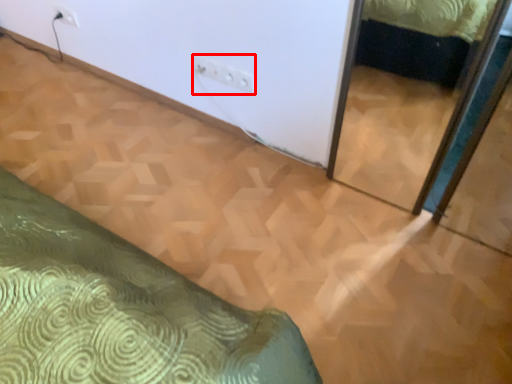
Question: From the image, what is the correct spatial relationship of electric outlet (annotated by the red box) in relation to electric outlet?

Choices:
 (A) left
 (B) right

Answer: (B)